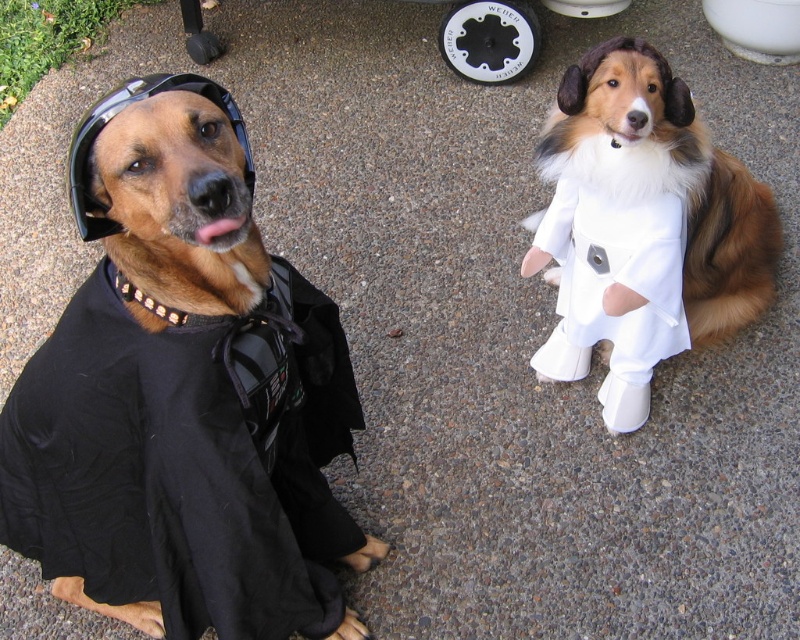
Which is more to the left, black matte shirt at left or white fur dress at right?

black matte shirt at left is more to the left.

Who is positioned more to the right, black matte shirt at left or white fur dress at right?

From the viewer's perspective, white fur dress at right appears more on the right side.

Is point (173, 452) farther from viewer compared to point (722, 266)?

No, (173, 452) is closer to viewer.

The height and width of the screenshot is (640, 800). Find the location of `black matte shirt at left`. black matte shirt at left is located at coordinates (184, 394).